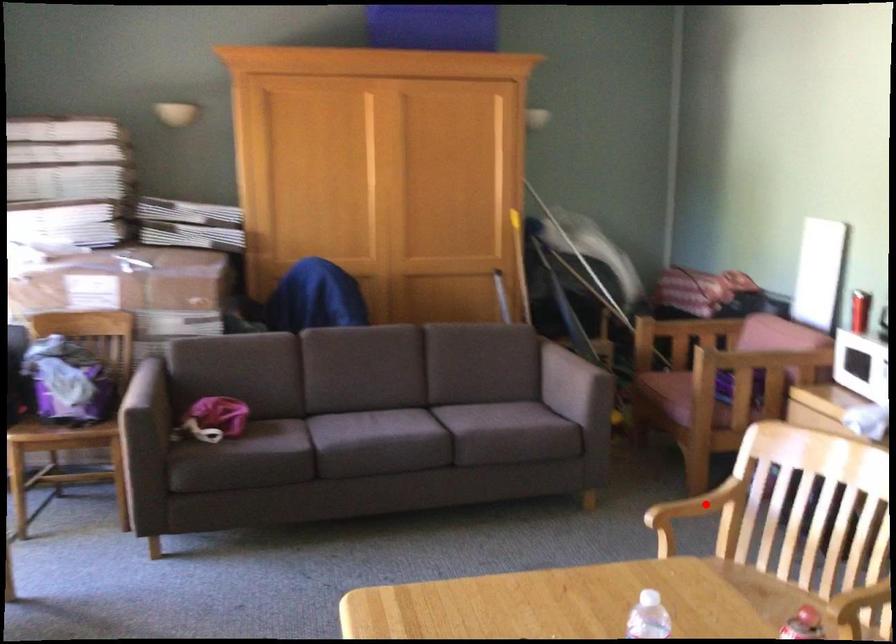
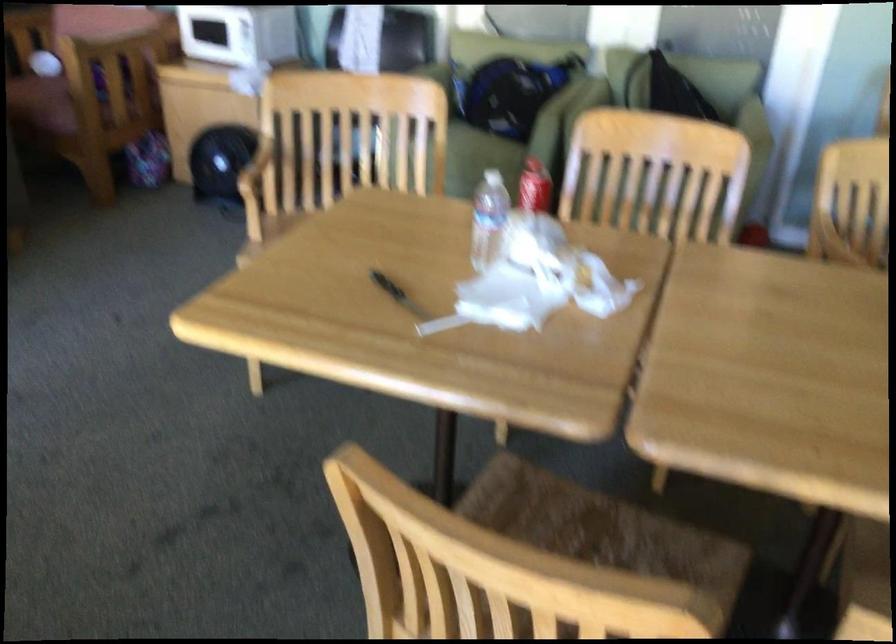
Find the pixel in the second image that matches the highlighted location in the first image.

(255, 166)